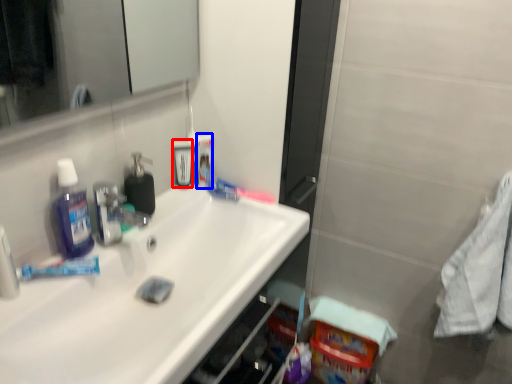
Question: Among these objects, which one is nearest to the camera, mouthwash (highlighted by a red box) or mouthwash (highlighted by a blue box)?

Choices:
 (A) mouthwash
 (B) mouthwash

Answer: (A)